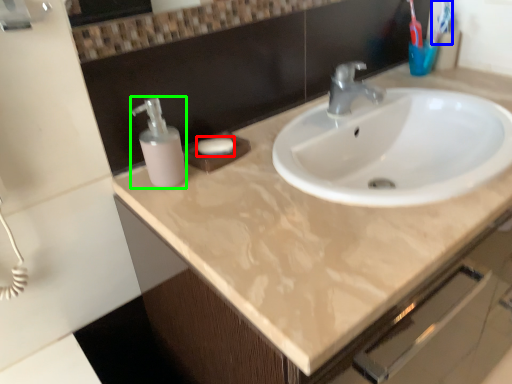
Question: Which object is positioned farthest from soap (highlighted by a red box)? Select from toothbrush (highlighted by a blue box) and soap dispenser (highlighted by a green box).

Choices:
 (A) toothbrush
 (B) soap dispenser

Answer: (A)